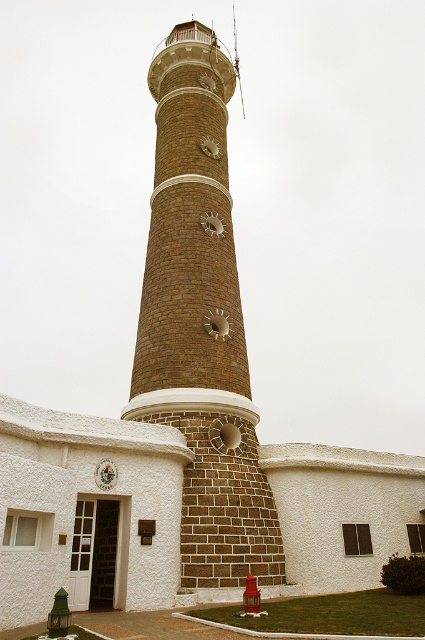
Who is more distant from viewer, (146, 362) or (254, 584)?

The point (146, 362) is more distant.

Does brown brick tower at center appear over red matte hydrant at lower center?

Correct, brown brick tower at center is located above red matte hydrant at lower center.

Which is behind, point (209, 125) or point (252, 588)?

The point (209, 125) is behind.

Find the location of a particular element. The height and width of the screenshot is (640, 425). brown brick tower at center is located at coordinates (201, 323).